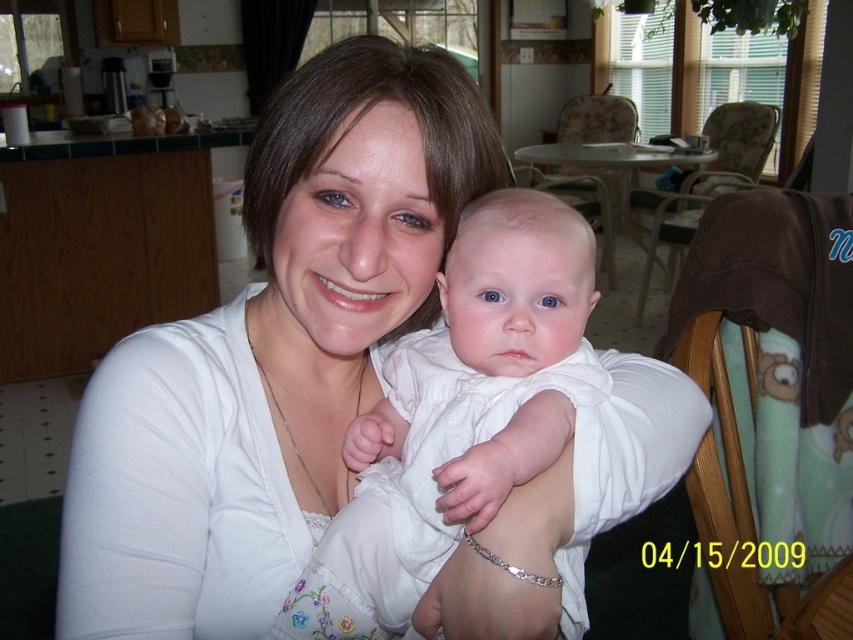
Question: Which object is the closest to the wooden chair at center?

Choices:
 (A) white fabric at center
 (B) white satin dress at center

Answer: (A)

Question: Is the position of brown fleece blanket at right less distant than that of brown fabric chair at center?

Choices:
 (A) yes
 (B) no

Answer: (A)

Question: Considering the relative positions of white fabric at center and white satin dress at center in the image provided, where is white fabric at center located with respect to white satin dress at center?

Choices:
 (A) right
 (B) left

Answer: (B)

Question: Does white satin dress at center appear over wooden chair at center?

Choices:
 (A) no
 (B) yes

Answer: (A)

Question: Estimate the real-world distances between objects in this image. Which object is closer to the white fabric at center?

Choices:
 (A) white satin dress at center
 (B) brown fleece blanket at right
 (C) wooden chair at center
 (D) brown fabric chair at center

Answer: (A)

Question: Which object appears closest to the camera in this image?

Choices:
 (A) white fabric at center
 (B) brown fleece blanket at right
 (C) brown fabric chair at center

Answer: (A)